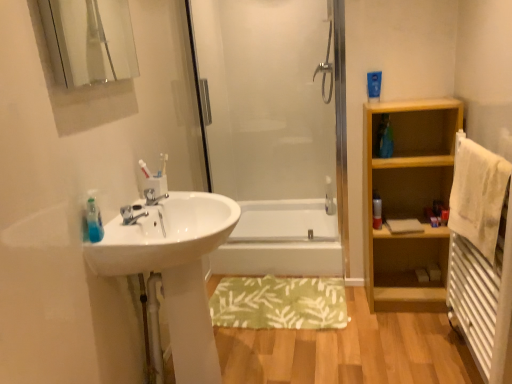
In order to face white glossy sink at left, should I rotate leftwards or rightwards?

A 8.717 degree turn to the left will do.

Identify the location of white glossy sink at left. (174, 269).

What do you see at coordinates (478, 194) in the screenshot? Image resolution: width=512 pixels, height=384 pixels. I see `white soft towel at right` at bounding box center [478, 194].

I want to click on light wood shelf at right, so click(x=408, y=201).

The height and width of the screenshot is (384, 512). Describe the element at coordinates (408, 201) in the screenshot. I see `light wood shelf at right` at that location.

Measure the distance between point [374,208] and camera.

They are 2.27 meters apart.

Image resolution: width=512 pixels, height=384 pixels. What do you see at coordinates (377, 210) in the screenshot?
I see `white plastic bottle at right` at bounding box center [377, 210].

The height and width of the screenshot is (384, 512). In order to click on green fabric bath mat at center in this screenshot , I will do `click(279, 303)`.

The height and width of the screenshot is (384, 512). What are the coordinates of `white glossy sink at left` in the screenshot? It's located at (174, 269).

From a real-world perspective, between light wood shelf at right and white textured radiator at right, who is vertically lower?

From a 3D spatial view, white textured radiator at right is below.

What's the angular difference between light wood shelf at right and white textured radiator at right's facing directions?

87.5 degrees.

From the picture: Considering the sizes of objects light wood shelf at right and white textured radiator at right in the image provided, who is shorter, light wood shelf at right or white textured radiator at right?

white textured radiator at right.

Which point is more distant from viewer, (445, 112) or (480, 259)?

Point (445, 112)

Is transparent glass shower door at center positioned with its back to green fabric bath mat at center?

transparent glass shower door at center is not turned away from green fabric bath mat at center.

From a real-world perspective, which object stands above the other?

transparent glass shower door at center, from a real-world perspective.

Considering the sizes of objects transparent glass shower door at center and green fabric bath mat at center in the image provided, who is shorter, transparent glass shower door at center or green fabric bath mat at center?

Standing shorter between the two is green fabric bath mat at center.

Consider the image. Which object is closer to the camera, transparent glass shower door at center or green fabric bath mat at center?

green fabric bath mat at center is more forward.

Considering the sizes of objects white glossy bathtub at center and transparent glass shower door at center in the image provided, who is wider, white glossy bathtub at center or transparent glass shower door at center?

With larger width is white glossy bathtub at center.

From the image's perspective, which is below, white glossy bathtub at center or transparent glass shower door at center?

white glossy bathtub at center, from the image's perspective.

Considering the relative positions of white glossy bathtub at center and transparent glass shower door at center in the image provided, is white glossy bathtub at center behind transparent glass shower door at center?

Yes, white glossy bathtub at center is further from the viewer.

Is white plastic bottle at right in front of or behind white glossy bathtub at center in the image?

white plastic bottle at right is in front of white glossy bathtub at center.

Is white plastic bottle at right smaller than white glossy bathtub at center?

Yes, white plastic bottle at right is smaller than white glossy bathtub at center.

From a real-world perspective, is white plastic bottle at right positioned under white glossy bathtub at center based on gravity?

No, from a real-world perspective, white plastic bottle at right is not below white glossy bathtub at center.

Considering the positions of objects white plastic bottle at right and white glossy bathtub at center in the image provided, who is more to the right, white plastic bottle at right or white glossy bathtub at center?

white plastic bottle at right.

Which object is closer to the camera taking this photo, green fabric bath mat at center or clear glass mirror at upper left?

clear glass mirror at upper left is more forward.

From the image's perspective, is green fabric bath mat at center above clear glass mirror at upper left?

No, from the image's perspective, green fabric bath mat at center is not on top of clear glass mirror at upper left.

Considering the relative sizes of green fabric bath mat at center and clear glass mirror at upper left in the image provided, is green fabric bath mat at center taller than clear glass mirror at upper left?

In fact, green fabric bath mat at center may be shorter than clear glass mirror at upper left.

In the scene shown: Considering the relative sizes of green fabric bath mat at center and white glossy sink at left in the image provided, is green fabric bath mat at center taller than white glossy sink at left?

No.

Could you tell me if green fabric bath mat at center is facing white glossy sink at left?

No, green fabric bath mat at center does not turn towards white glossy sink at left.

Does point (317, 285) come in front of point (117, 253)?

No, it is not.

How different are the orientations of green fabric bath mat at center and white glossy sink at left in degrees?

There is a 91.2-degree angle between the facing directions of green fabric bath mat at center and white glossy sink at left.

Consider the image. Can you confirm if light wood shelf at right is positioned to the right of white plastic bottle at right?

Correct, you'll find light wood shelf at right to the right of white plastic bottle at right.

From a real-world perspective, is light wood shelf at right positioned above or below white plastic bottle at right?

In terms of real-world spatial position, light wood shelf at right is below white plastic bottle at right.

Considering the relative sizes of light wood shelf at right and white plastic bottle at right in the image provided, is light wood shelf at right smaller than white plastic bottle at right?

Actually, light wood shelf at right might be larger than white plastic bottle at right.

Find the location of a particular element. This screenshot has width=512, height=384. bathroom cabinet above the white textured radiator at right (from a real-world perspective) is located at coordinates (408, 201).

In order to click on screen door that is behind the green fabric bath mat at center in this screenshot , I will do `click(270, 131)`.

When comparing their distances from white glossy sink at left, does green fabric bath mat at center or white plastic bottle at right seem further?

The object further to white glossy sink at left is white plastic bottle at right.

From the picture: From the image, which object appears to be farther from clear glass mirror at upper left, green fabric bath mat at center or white soft towel at right?

white soft towel at right is further to clear glass mirror at upper left.

From the image, which object appears to be nearer to green fabric bath mat at center, light wood shelf at right or white textured radiator at right?

Based on the image, light wood shelf at right appears to be nearer to green fabric bath mat at center.

Which object lies further to the anchor point white soft towel at right, white plastic bottle at right or clear glass mirror at upper left?

clear glass mirror at upper left lies further to white soft towel at right than the other object.

Estimate the real-world distances between objects in this image. Which object is closer to white glossy sink at left, light wood shelf at right or clear glass mirror at upper left?

Based on the image, light wood shelf at right appears to be nearer to white glossy sink at left.

When comparing their distances from white plastic bottle at right, does light wood shelf at right or white glossy bathtub at center seem further?

Among the two, white glossy bathtub at center is located further to white plastic bottle at right.

In the scene shown: When comparing their distances from green fabric bath mat at center, does white soft towel at right or white plastic bottle at right seem further?

white soft towel at right lies further to green fabric bath mat at center than the other object.

Based on their spatial positions, is green fabric bath mat at center or white glossy bathtub at center closer to clear glass mirror at upper left?

white glossy bathtub at center.

The width and height of the screenshot is (512, 384). Find the location of `toiletry between white textured radiator at right and green fabric bath mat at center along the z-axis`. toiletry between white textured radiator at right and green fabric bath mat at center along the z-axis is located at coordinates (377, 210).

The image size is (512, 384). I want to click on bath towel between white textured radiator at right and light wood shelf at right along the z-axis, so click(478, 194).

What are the coordinates of `bathroom cabinet located between white glossy sink at left and white glossy bathtub at center in the depth direction` in the screenshot? It's located at (408, 201).

You are a GUI agent. You are given a task and a screenshot of the screen. Output one action in this format:
    pyautogui.click(x=<x>, y=<y>)
    Task: Click on the bathroom cabinet between white textured radiator at right and transparent glass shower door at center from front to back
    The width and height of the screenshot is (512, 384).
    Given the screenshot: What is the action you would take?
    pyautogui.click(x=408, y=201)